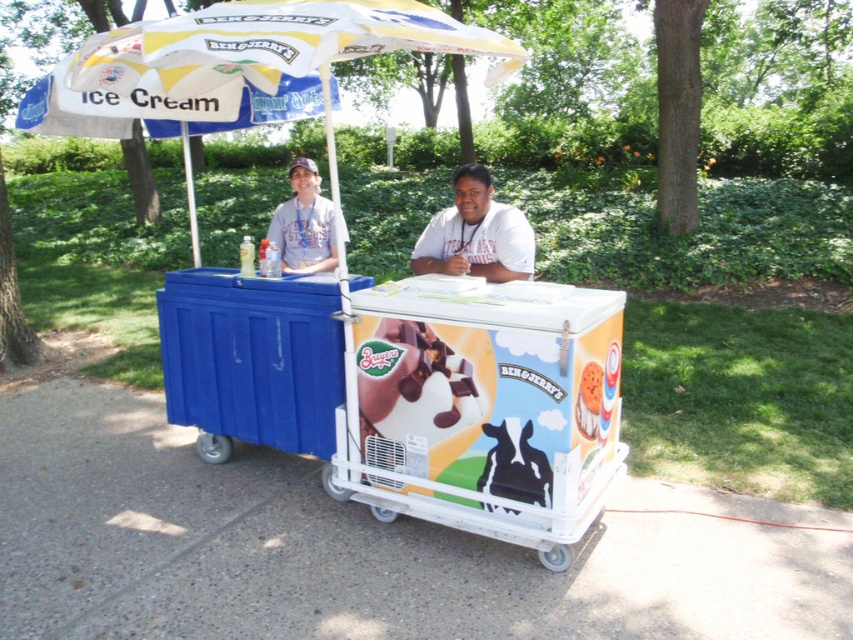
Who is shorter, yellow fabric umbrella at upper center or light blue shirt at center?

yellow fabric umbrella at upper center is shorter.

Who is lower down, yellow fabric umbrella at upper center or light blue shirt at center?

Positioned lower is light blue shirt at center.

Between point (465, 38) and point (312, 211), which one is positioned in front?

Point (465, 38) is in front.

Locate an element on the screen. yellow fabric umbrella at upper center is located at coordinates (277, 42).

Between point (207, 106) and point (302, 180), which one is positioned in front?

Positioned in front is point (207, 106).

From the picture: Does white fabric umbrella at upper left have a lesser height compared to light blue shirt at center?

Indeed, white fabric umbrella at upper left has a lesser height compared to light blue shirt at center.

Which is in front, point (248, 112) or point (296, 166)?

Point (248, 112) is more forward.

The image size is (853, 640). What are the coordinates of `white fabric umbrella at upper left` in the screenshot? It's located at (165, 100).

Consider the image. Can you confirm if white fabric umbrella at upper left is bigger than white matte shirt at center?

No, white fabric umbrella at upper left is not bigger than white matte shirt at center.

Looking at this image, is white fabric umbrella at upper left below white matte shirt at center?

Actually, white fabric umbrella at upper left is above white matte shirt at center.

Image resolution: width=853 pixels, height=640 pixels. What are the coordinates of `white fabric umbrella at upper left` in the screenshot? It's located at (165, 100).